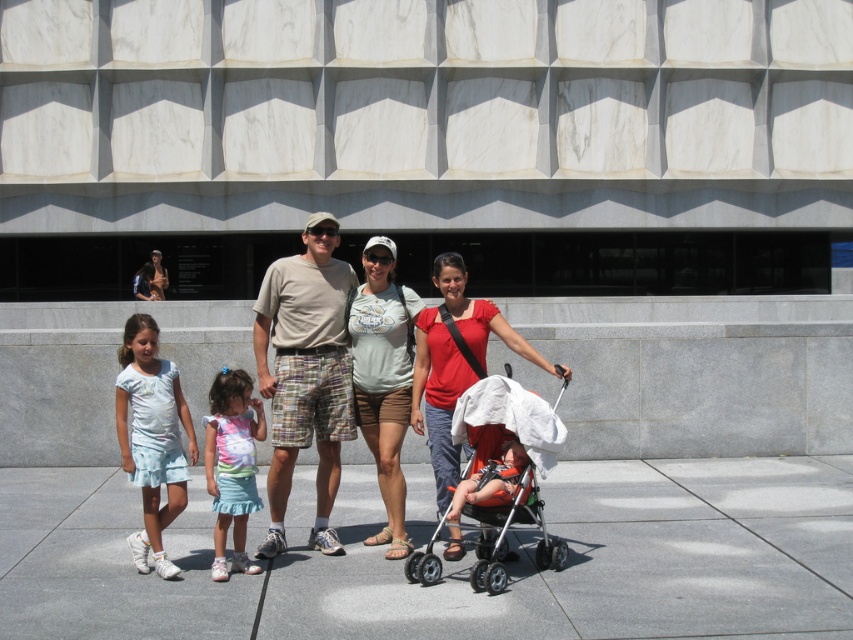
Question: Estimate the real-world distances between objects in this image. Which object is closer to the tie-dye fabric dress at center?

Choices:
 (A) light blue cotton dress at left
 (B) matte gray t-shirt at center

Answer: (A)

Question: Is matte gray t-shirt at center below orange fabric baby carriage at center?

Choices:
 (A) yes
 (B) no

Answer: (B)

Question: Can you confirm if beige cotton t-shirt at center is wider than matte white stroller at center?

Choices:
 (A) yes
 (B) no

Answer: (B)

Question: Does light blue cotton dress at left have a larger size compared to tie-dye fabric dress at center?

Choices:
 (A) no
 (B) yes

Answer: (B)

Question: Among these objects, which one is farthest from the camera?

Choices:
 (A) beige cotton t-shirt at center
 (B) light blue cotton dress at left
 (C) gray concrete pavement at center

Answer: (A)

Question: Among these points, which one is farthest from the camera?

Choices:
 (A) (368, 403)
 (B) (238, 413)
 (C) (503, 428)
 (D) (312, 276)

Answer: (A)